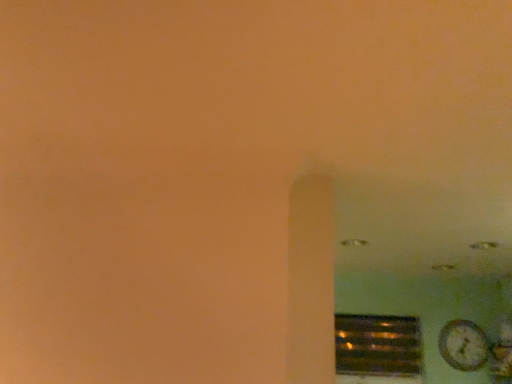
Question: Does metallic reflective vent at lower right have a lesser height compared to wooden textured clock at lower right?

Choices:
 (A) no
 (B) yes

Answer: (A)

Question: From the image's perspective, would you say metallic reflective vent at lower right is shown under wooden textured clock at lower right?

Choices:
 (A) no
 (B) yes

Answer: (B)

Question: Is metallic reflective vent at lower right at the right side of wooden textured clock at lower right?

Choices:
 (A) yes
 (B) no

Answer: (B)

Question: Is metallic reflective vent at lower right behind wooden textured clock at lower right?

Choices:
 (A) yes
 (B) no

Answer: (A)

Question: Is metallic reflective vent at lower right turned away from wooden textured clock at lower right?

Choices:
 (A) no
 (B) yes

Answer: (A)

Question: Is the position of metallic reflective vent at lower right less distant than that of wooden textured clock at lower right?

Choices:
 (A) no
 (B) yes

Answer: (A)

Question: Is wooden textured clock at lower right turned away from metallic reflective vent at lower right?

Choices:
 (A) no
 (B) yes

Answer: (A)

Question: Does wooden textured clock at lower right have a larger size compared to metallic reflective vent at lower right?

Choices:
 (A) no
 (B) yes

Answer: (A)

Question: Is wooden textured clock at lower right at the left side of metallic reflective vent at lower right?

Choices:
 (A) no
 (B) yes

Answer: (A)

Question: Considering the relative positions of wooden textured clock at lower right and metallic reflective vent at lower right in the image provided, is wooden textured clock at lower right behind metallic reflective vent at lower right?

Choices:
 (A) yes
 (B) no

Answer: (B)

Question: From the image's perspective, is wooden textured clock at lower right located beneath metallic reflective vent at lower right?

Choices:
 (A) no
 (B) yes

Answer: (A)

Question: Is wooden textured clock at lower right facing towards metallic reflective vent at lower right?

Choices:
 (A) yes
 (B) no

Answer: (B)

Question: Is point (475, 337) positioned closer to the camera than point (352, 324)?

Choices:
 (A) farther
 (B) closer

Answer: (B)